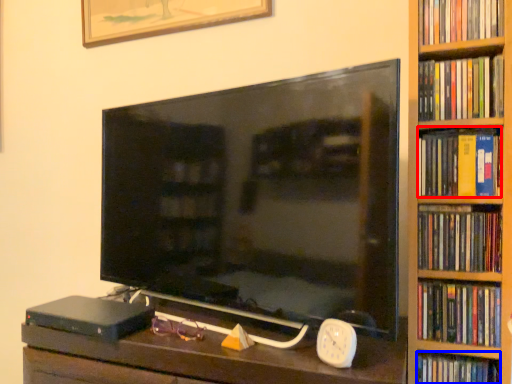
Question: Which of the following is the farthest to the observer, book (highlighted by a red box) or book (highlighted by a blue box)?

Choices:
 (A) book
 (B) book

Answer: (B)